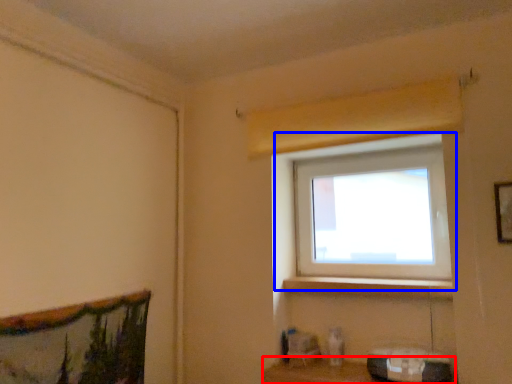
Question: Among these objects, which one is nearest to the camera, shelf (highlighted by a red box) or window (highlighted by a blue box)?

Choices:
 (A) shelf
 (B) window

Answer: (A)